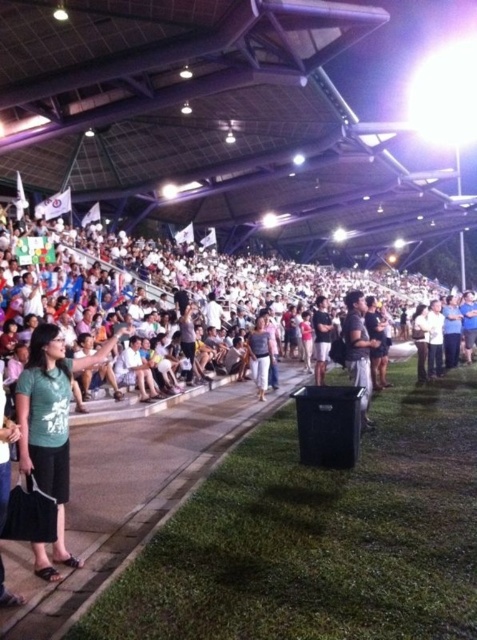
Between white fabric crowd at upper center and black fabric shirt at center, which one appears on the right side from the viewer's perspective?

white fabric crowd at upper center is more to the right.

Find the location of a particular element. This screenshot has width=477, height=640. white fabric crowd at upper center is located at coordinates (183, 280).

At what (x,y) coordinates should I click in order to perform the action: click on white fabric crowd at upper center. Please return your answer as a coordinate pair (x, y). Image resolution: width=477 pixels, height=640 pixels. Looking at the image, I should click on [x=183, y=280].

Where is `white fabric crowd at upper center`? This screenshot has width=477, height=640. white fabric crowd at upper center is located at coordinates (183, 280).

Between black fabric shirt at center and light brown fabric pants at center, which one has more height?

black fabric shirt at center is taller.

Can you confirm if black fabric shirt at center is shorter than light brown fabric pants at center?

No, black fabric shirt at center is not shorter than light brown fabric pants at center.

Describe the element at coordinates (359, 349) in the screenshot. Image resolution: width=477 pixels, height=640 pixels. I see `black fabric shirt at center` at that location.

Where is `black fabric shirt at center`? The image size is (477, 640). black fabric shirt at center is located at coordinates (359, 349).

Between white fabric crowd at upper center and dark gray fabric shirt at center, which one is positioned higher?

white fabric crowd at upper center is above.

Is white fabric crowd at upper center thinner than dark gray fabric shirt at center?

No, white fabric crowd at upper center is not thinner than dark gray fabric shirt at center.

Does point (355, 289) lie behind point (317, 378)?

Yes, point (355, 289) is behind point (317, 378).

Where is `white fabric crowd at upper center`? The image size is (477, 640). white fabric crowd at upper center is located at coordinates (183, 280).